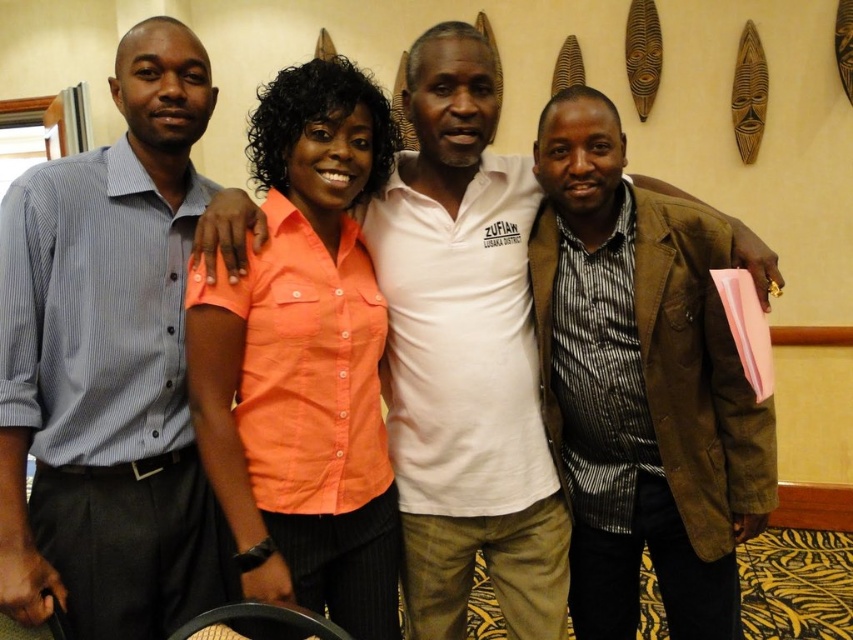
Who is positioned more to the left, brown textured blazer at right or white cotton shirt at center?

From the viewer's perspective, white cotton shirt at center appears more on the left side.

Between brown textured blazer at right and white cotton shirt at center, which one appears on the right side from the viewer's perspective?

brown textured blazer at right is more to the right.

Is point (602, 566) closer to viewer compared to point (463, 634)?

Yes.

Find the location of a particular element. This screenshot has height=640, width=853. brown textured blazer at right is located at coordinates (640, 385).

Is brown textured blazer at right to the right of orange cotton shirt at center from the viewer's perspective?

Indeed, brown textured blazer at right is positioned on the right side of orange cotton shirt at center.

Can you confirm if brown textured blazer at right is positioned above orange cotton shirt at center?

No.

This screenshot has width=853, height=640. I want to click on brown textured blazer at right, so click(x=640, y=385).

I want to click on brown textured blazer at right, so click(640, 385).

Does blue striped shirt at left have a lesser height compared to white cotton shirt at center?

Indeed, blue striped shirt at left has a lesser height compared to white cotton shirt at center.

Is blue striped shirt at left further to the viewer compared to white cotton shirt at center?

No, it is not.

You are a GUI agent. You are given a task and a screenshot of the screen. Output one action in this format:
    pyautogui.click(x=<x>, y=<y>)
    Task: Click on the blue striped shirt at left
    This screenshot has height=640, width=853.
    Given the screenshot: What is the action you would take?
    pyautogui.click(x=109, y=364)